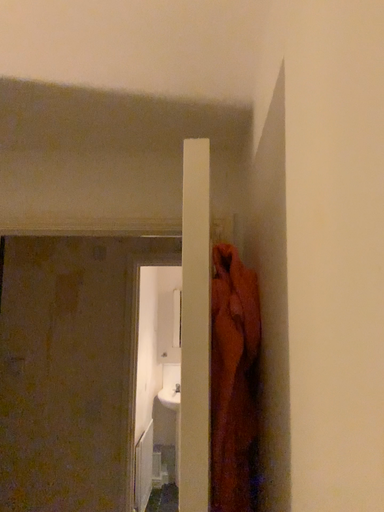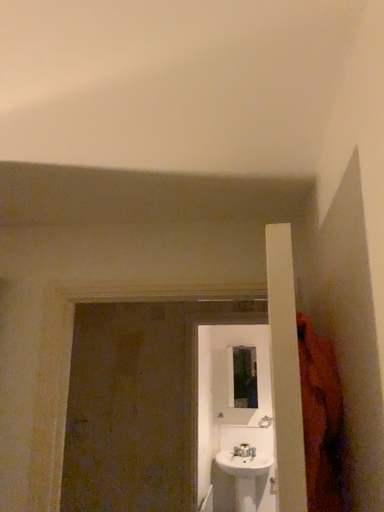
Question: How did the camera likely rotate when shooting the video?

Choices:
 (A) rotated upward
 (B) rotated downward

Answer: (A)